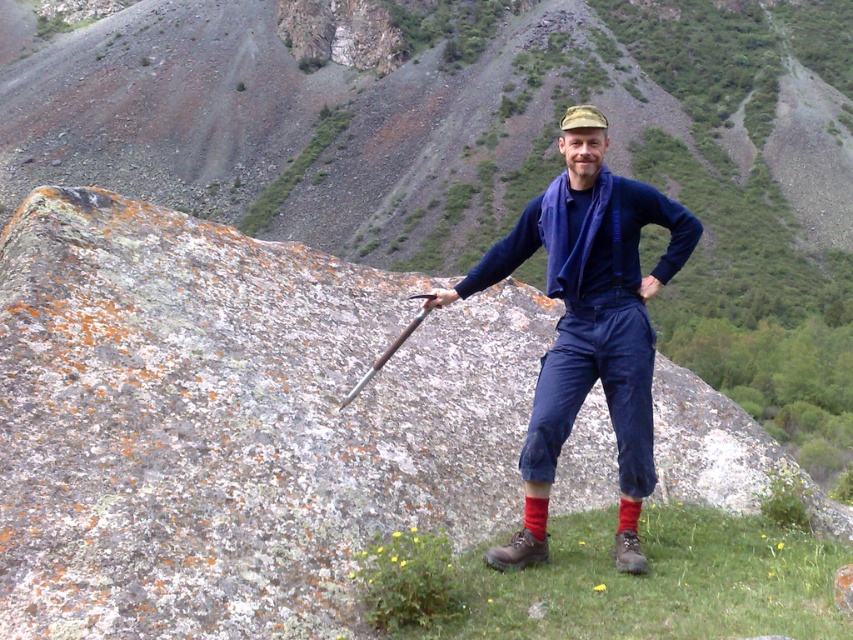
Question: Which of these objects is positioned closest to the shiny metal pole at center?

Choices:
 (A) blue fabric shirt at center
 (B) brown leather boot at lower center

Answer: (B)

Question: Based on their relative distances, which object is nearer to the blue fabric shirt at center?

Choices:
 (A) brown leather boot at lower center
 (B) shiny metal pole at center

Answer: (A)

Question: In this image, where is blue fabric shirt at center located relative to shiny metal pole at center?

Choices:
 (A) above
 (B) below

Answer: (A)

Question: In this image, where is blue fabric shirt at center located relative to shiny metal pole at center?

Choices:
 (A) above
 (B) below

Answer: (A)

Question: Which point appears farthest from the camera in this image?

Choices:
 (A) (408, 333)
 (B) (491, 548)
 (C) (614, 552)

Answer: (A)

Question: Is brown leather boot at lower center positioned in front of brown suede boot at lower right?

Choices:
 (A) yes
 (B) no

Answer: (A)